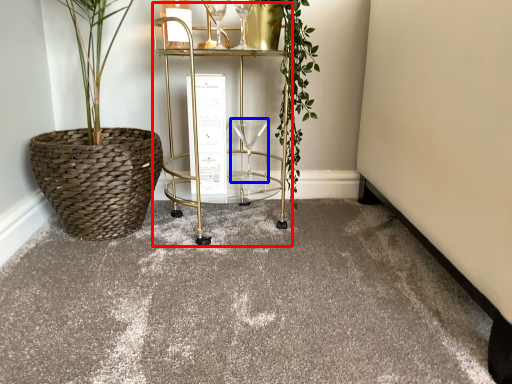
Question: Which object is closer to the camera taking this photo, cart (highlighted by a red box) or wine glass (highlighted by a blue box)?

Choices:
 (A) cart
 (B) wine glass

Answer: (A)